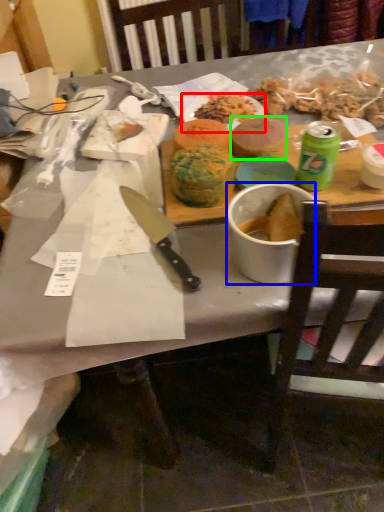
Question: Which is nearer to the plate (highlighted by a red box)? bowl (highlighted by a blue box) or food (highlighted by a green box).

Choices:
 (A) bowl
 (B) food

Answer: (B)